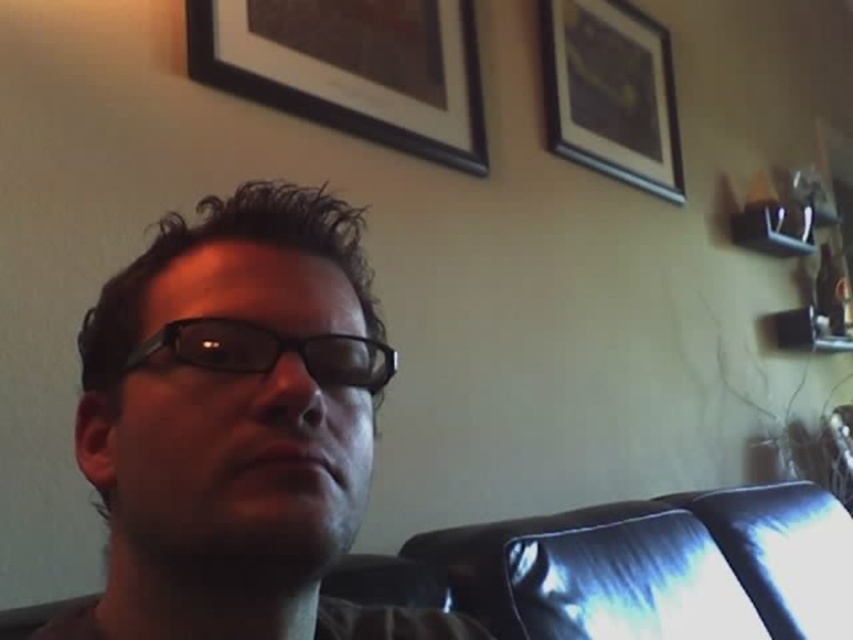
Question: Is matte black glasses at center below black plastic glasses at center?

Choices:
 (A) yes
 (B) no

Answer: (A)

Question: Is black matte picture frame at upper center behind black plastic glasses at center?

Choices:
 (A) no
 (B) yes

Answer: (B)

Question: Does black matte picture frame at upper center have a greater width compared to black plastic glasses at center?

Choices:
 (A) yes
 (B) no

Answer: (A)

Question: Estimate the real-world distances between objects in this image. Which object is closer to the wooden picture frame at upper center?

Choices:
 (A) black matte picture frame at upper center
 (B) matte black glasses at center
 (C) black plastic glasses at center

Answer: (A)

Question: Among these points, which one is nearest to the camera?

Choices:
 (A) click(x=216, y=330)
 (B) click(x=613, y=109)
 (C) click(x=143, y=588)
 (D) click(x=471, y=17)

Answer: (A)

Question: Which object is closer to the camera taking this photo?

Choices:
 (A) black plastic glasses at center
 (B) wooden picture frame at upper center
 (C) black matte picture frame at upper center
 (D) matte black glasses at center

Answer: (D)